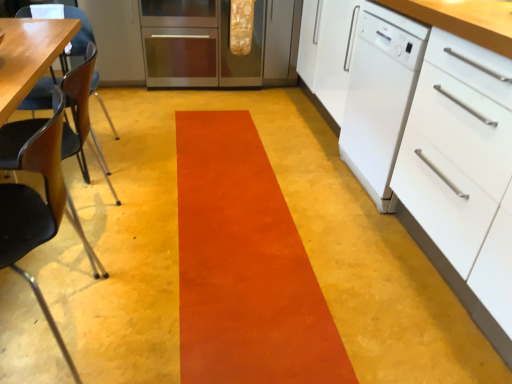
The width and height of the screenshot is (512, 384). I want to click on free space above orange suede rug at center (from a real-world perspective), so click(234, 212).